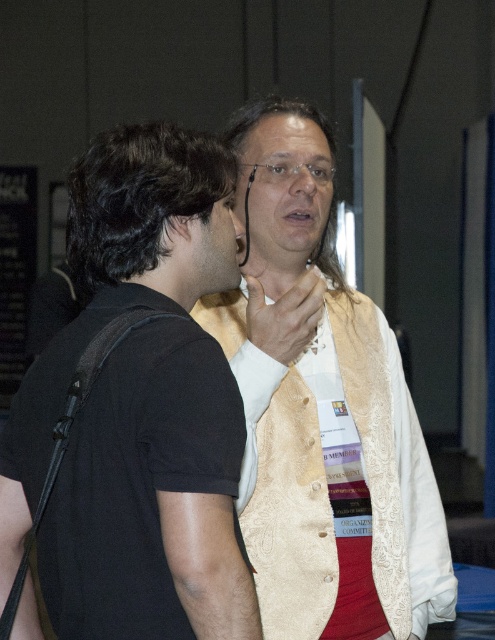
Consider the image. Who is positioned more to the right, black fabric bag at left or gold brocade vest at center?

From the viewer's perspective, gold brocade vest at center appears more on the right side.

Which is in front, point (215, 236) or point (261, 310)?

Point (215, 236) is in front.

Image resolution: width=495 pixels, height=640 pixels. In order to click on black fabric bag at left in this screenshot , I will do `click(139, 408)`.